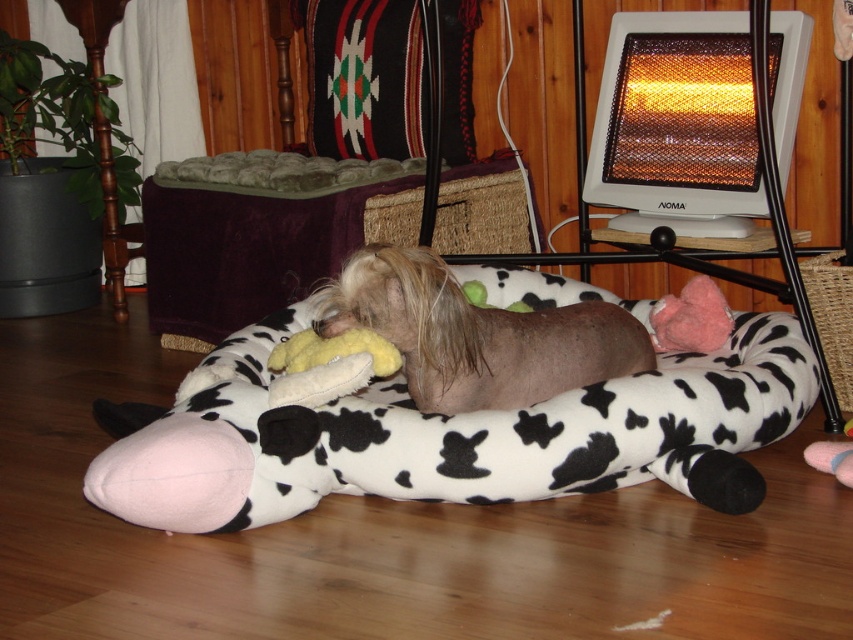
Question: Can you confirm if cow print plush at center is positioned to the right of cow print plush bed at center?

Choices:
 (A) yes
 (B) no

Answer: (A)

Question: Which of the following is the farthest from the observer?

Choices:
 (A) multicolored woven rug at upper center
 (B) brown fuzzy dog at center

Answer: (A)

Question: Which of the following is the farthest from the observer?

Choices:
 (A) cow print plush bed at center
 (B) cow print plush at center

Answer: (A)

Question: Observing the image, what is the correct spatial positioning of cow print plush at center in reference to multicolored woven rug at upper center?

Choices:
 (A) below
 (B) above

Answer: (A)

Question: Is cow print plush bed at center wider than multicolored woven rug at upper center?

Choices:
 (A) no
 (B) yes

Answer: (B)

Question: Which object is farther from the camera taking this photo?

Choices:
 (A) cow print plush at center
 (B) multicolored woven rug at upper center
 (C) cow print plush bed at center
 (D) brown fuzzy dog at center

Answer: (B)